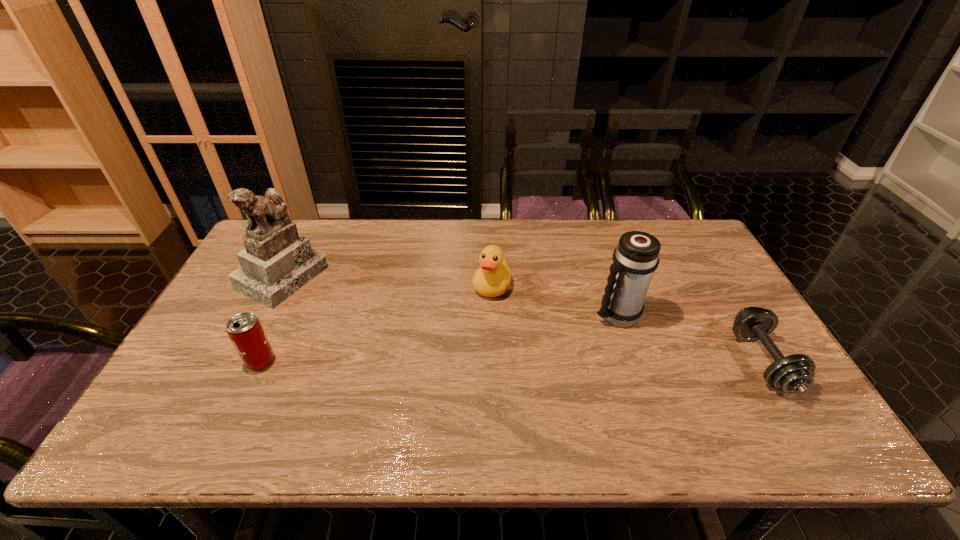
I want to click on object at the left edge, so click(x=277, y=262).

In order to click on object at the right edge in this screenshot , I will do `click(795, 373)`.

This screenshot has height=540, width=960. What are the coordinates of `object that is at the far left corner` in the screenshot? It's located at (277, 262).

I want to click on object located at the near right corner, so click(x=795, y=373).

You are a GUI agent. You are given a task and a screenshot of the screen. Output one action in this format:
    pyautogui.click(x=<x>, y=<y>)
    Task: Click on the vacant space at the far edge of the desktop
    This screenshot has height=540, width=960.
    Given the screenshot: What is the action you would take?
    pyautogui.click(x=331, y=245)

Locate an element on the screen. The height and width of the screenshot is (540, 960). vacant space at the near edge of the desktop is located at coordinates (684, 401).

You are a GUI agent. You are given a task and a screenshot of the screen. Output one action in this format:
    pyautogui.click(x=<x>, y=<y>)
    Task: Click on the vacant region at the right edge of the desktop
    
    Given the screenshot: What is the action you would take?
    pyautogui.click(x=732, y=375)

This screenshot has width=960, height=540. Find the location of `vacant space at the far right corner of the desktop`. vacant space at the far right corner of the desktop is located at coordinates (x=695, y=232).

Locate an element on the screen. The height and width of the screenshot is (540, 960). free space between the duck and the beer can is located at coordinates (376, 323).

Find the location of a particular element. The height and width of the screenshot is (540, 960). free area in between the figurine and the second object from right to left is located at coordinates (449, 295).